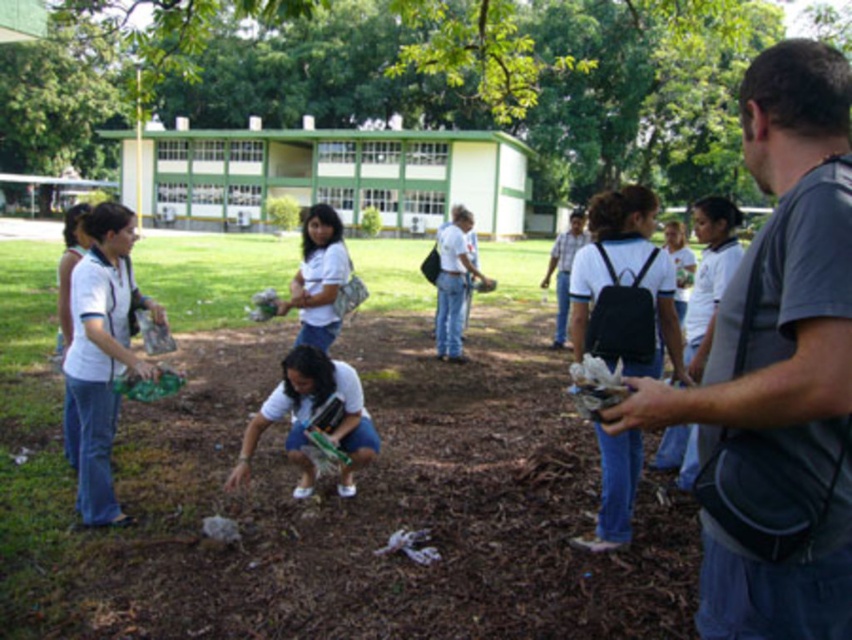
Question: Which point is closer to the camera?

Choices:
 (A) (314, 148)
 (B) (280, 400)

Answer: (B)

Question: Does green matte building at center have a smaller size compared to white matte shirt at center?

Choices:
 (A) no
 (B) yes

Answer: (A)

Question: Is the position of white matte book at center less distant than that of white matte shirt at center?

Choices:
 (A) yes
 (B) no

Answer: (A)

Question: Observing the image, what is the correct spatial positioning of white matte book at center in reference to white matte shirt at center?

Choices:
 (A) below
 (B) above

Answer: (A)

Question: Estimate the real-world distances between objects in this image. Which object is closer to the green leafy tree at upper center?

Choices:
 (A) white matte shirt at center
 (B) white matte book at center
 (C) white shirt at center

Answer: (B)

Question: Which of these objects is positioned closest to the white shirt at center?

Choices:
 (A) green leafy tree at upper center
 (B) green matte building at center
 (C) white matte book at center

Answer: (C)